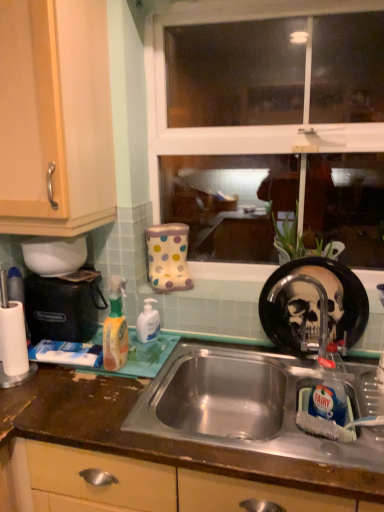
Question: Which is correct: translucent orange spray bottle at left, the second cleaning product in the back-to-front sequence, is inside brown laminate countertop at center, or outside of it?

Choices:
 (A) inside
 (B) outside

Answer: (B)

Question: Is translucent orange spray bottle at left, marked as the first cleaning product in a left-to-right arrangement, in front of or behind brown laminate countertop at center in the image?

Choices:
 (A) behind
 (B) front

Answer: (A)

Question: Which is nearer to the brown laminate countertop at center?

Choices:
 (A) white glossy hand soap at center, placed as the 2th cleaning product when sorted from front to back
 (B) translucent orange spray bottle at left, the second cleaning product in the back-to-front sequence
 (C) light wood/finish cabinet at left
 (D) brushed metal faucet at sink right
 (E) transparent glass window at center

Answer: (B)

Question: Based on their relative distances, which object is farther from the black plastic coffee machine at left?

Choices:
 (A) brown laminate countertop at center
 (B) transparent glass window at center
 (C) translucent orange spray bottle at left, the 1th cleaning product viewed from the front
 (D) white matte toothpaste at lower left
 (E) light wood/finish cabinet at left

Answer: (B)